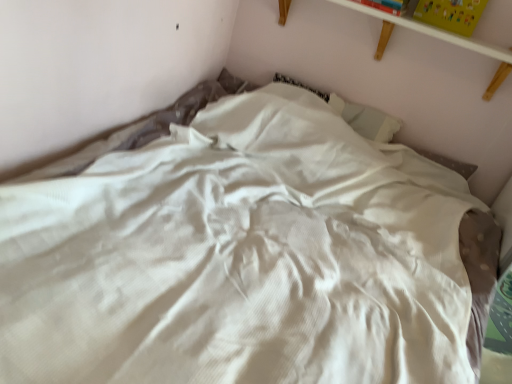
Question: In terms of height, does white wooden shelf at upper center look taller or shorter compared to yellow matte paper at upper right, which is counted as the 1th paperback book, starting from the right?

Choices:
 (A) tall
 (B) short

Answer: (B)

Question: From a real-world perspective, is white wooden shelf at upper center physically located above or below yellow matte paper at upper right, which is counted as the second paperback book, starting from the left?

Choices:
 (A) above
 (B) below

Answer: (B)

Question: Estimate the real-world distances between objects in this image. Which object is farther from the hardcover book at upper right, the 2th paperback book from the right?

Choices:
 (A) yellow matte paper at upper right, which is counted as the 1th paperback book, starting from the right
 (B) white wooden shelf at upper center

Answer: (A)

Question: Considering the real-world distances, which object is farthest from the yellow matte paper at upper right, which is counted as the 1th paperback book, starting from the right?

Choices:
 (A) white wooden shelf at upper center
 (B) hardcover book at upper right, the 2th paperback book from the right

Answer: (B)